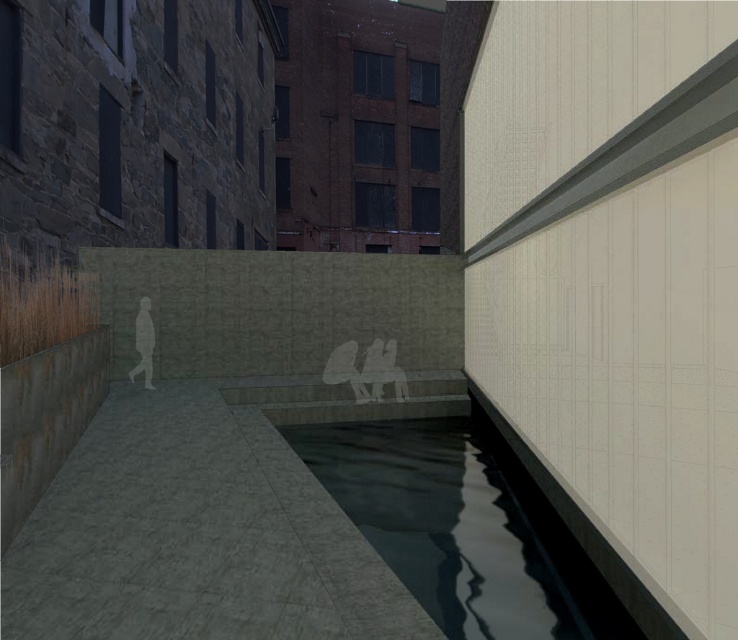
You are standing in the courtyard and want to find the dark reflective water at center. According to the scene description, where should you look relative to the textured stone wall on the left?

The dark reflective water at center is located at point (462, 525), which is to the right of the textured stone wall on the left.

From the picture: You are an architect designing a new plaza and want to ensure that the dark reflective water at center and the silhouette figure at center are visually balanced. Considering their sizes, which object should you adjust to achieve this balance?

Since the dark reflective water at center is larger than the silhouette figure at center, you should increase the size of the silhouette figure at center or decrease the size of the dark reflective water at center to achieve visual balance.